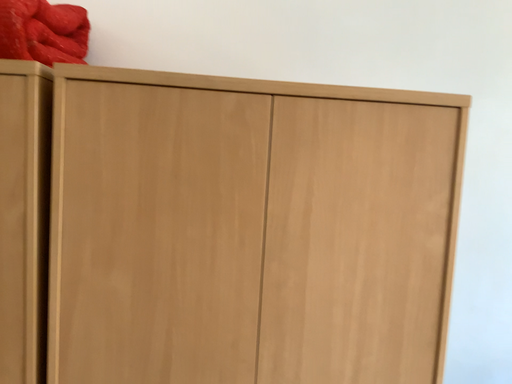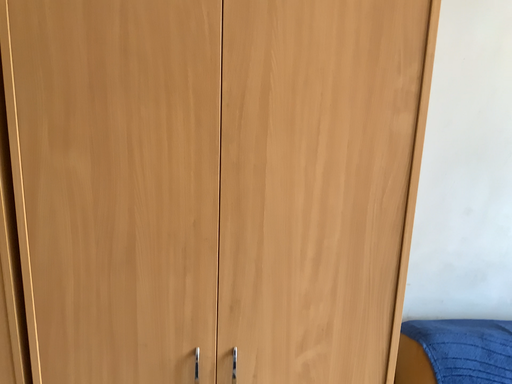
Question: How did the camera likely rotate when shooting the video?

Choices:
 (A) rotated downward
 (B) rotated upward

Answer: (A)